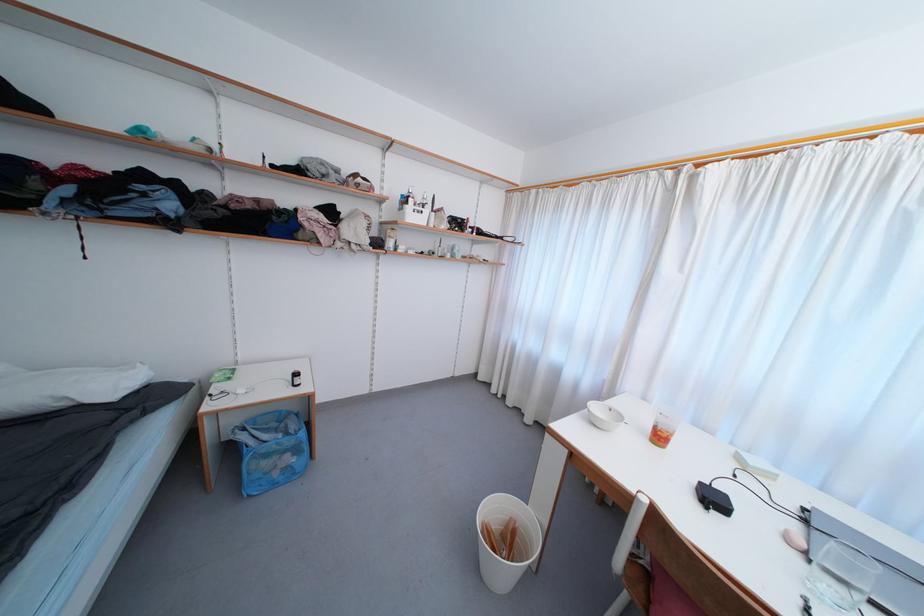
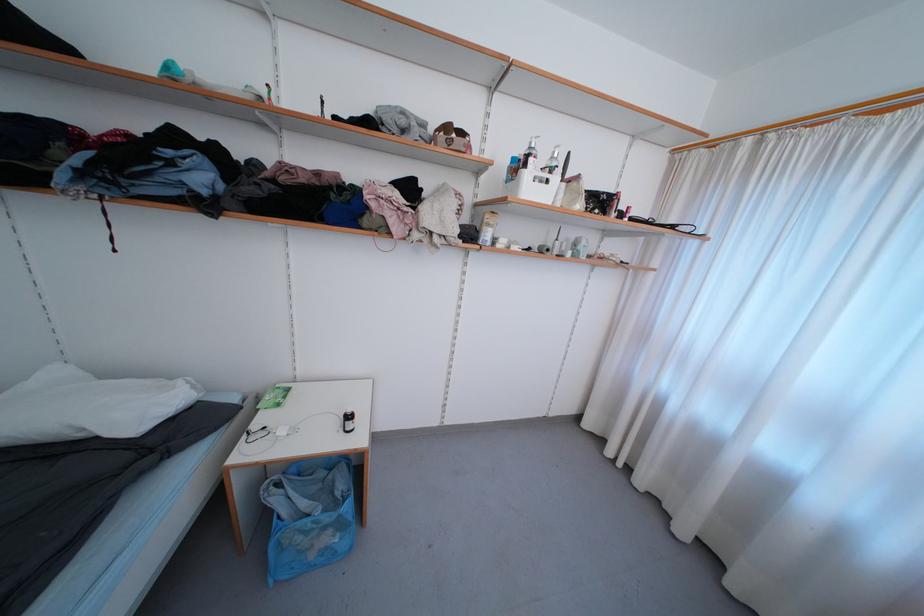
Locate, in the second image, the point that corresponds to pixel 410 205 in the first image.

(529, 168)